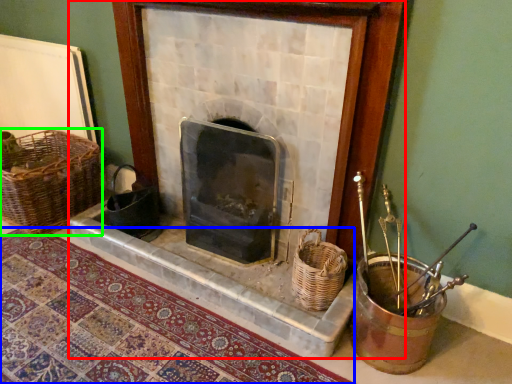
Question: Estimate the real-world distances between objects in this image. Which object is closer to fireplace (highlighted by a red box), mat (highlighted by a blue box) or basket (highlighted by a green box)?

Choices:
 (A) mat
 (B) basket

Answer: (A)